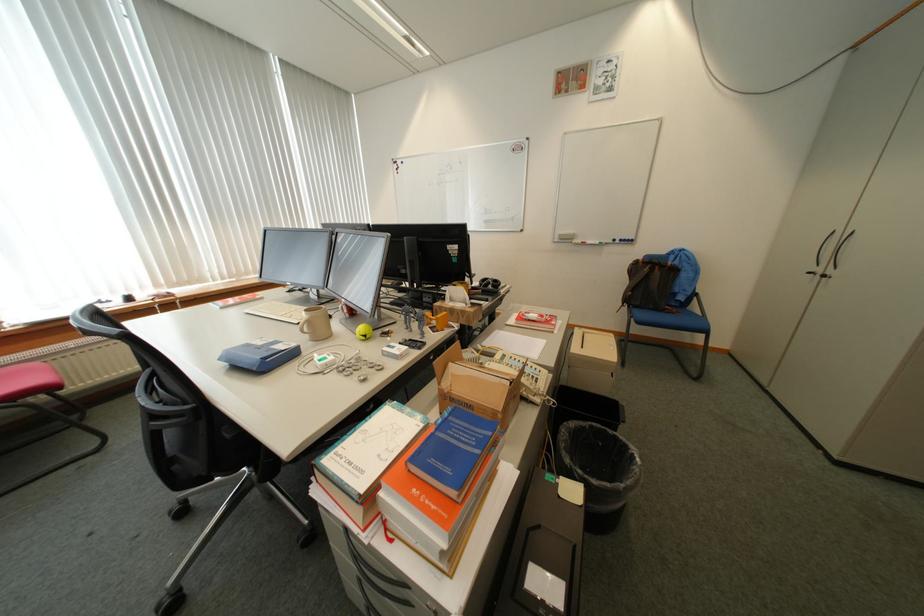
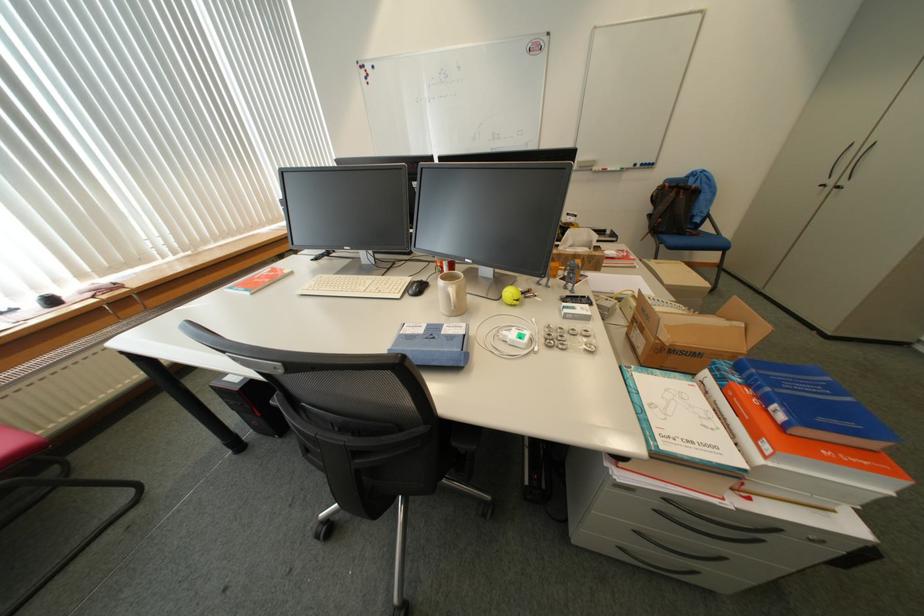
Question: I am providing you with two images of the same scene from different viewpoints. After the viewpoint changes to image2, which objects are now occluded?

Choices:
 (A) black backpack
 (B) drawer handle
 (C) orange hardcover book
 (D) none of these

Answer: (D)